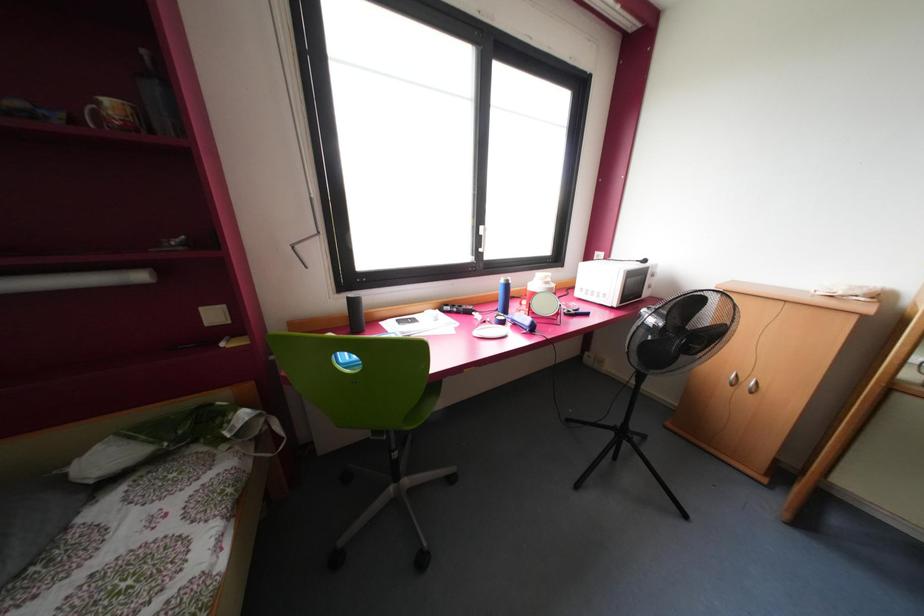
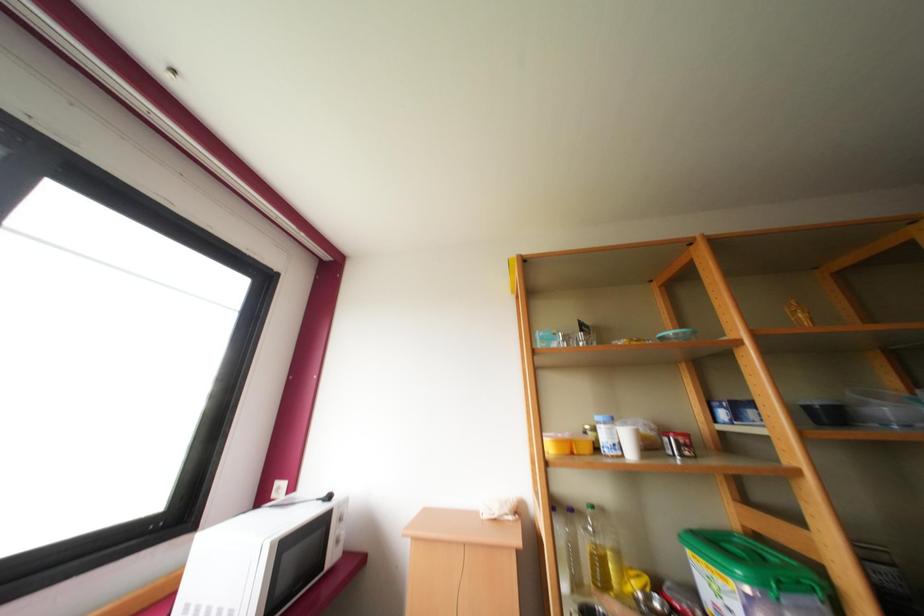
The images are taken continuously from a first-person perspective. In which direction is your viewpoint rotating?

The camera's rotation is toward right-up.